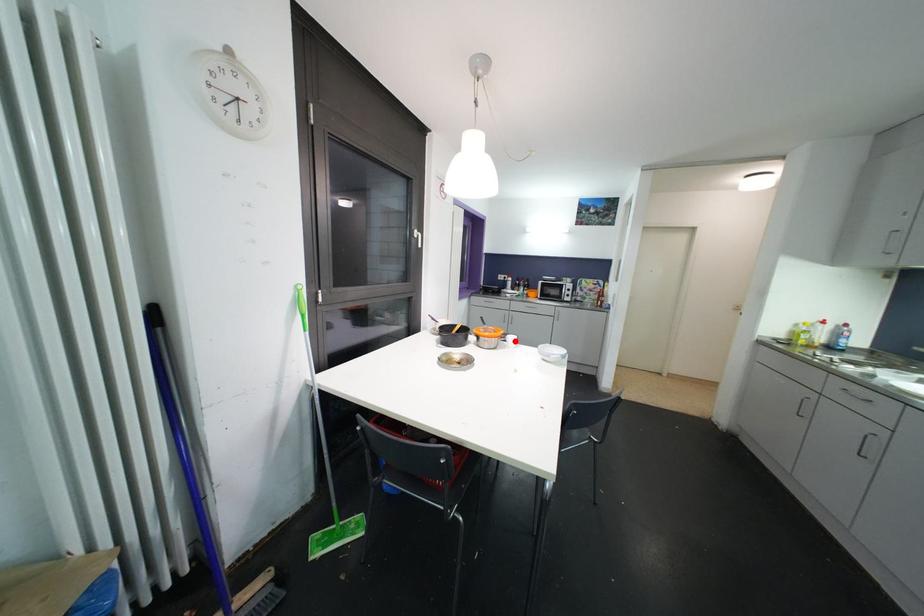
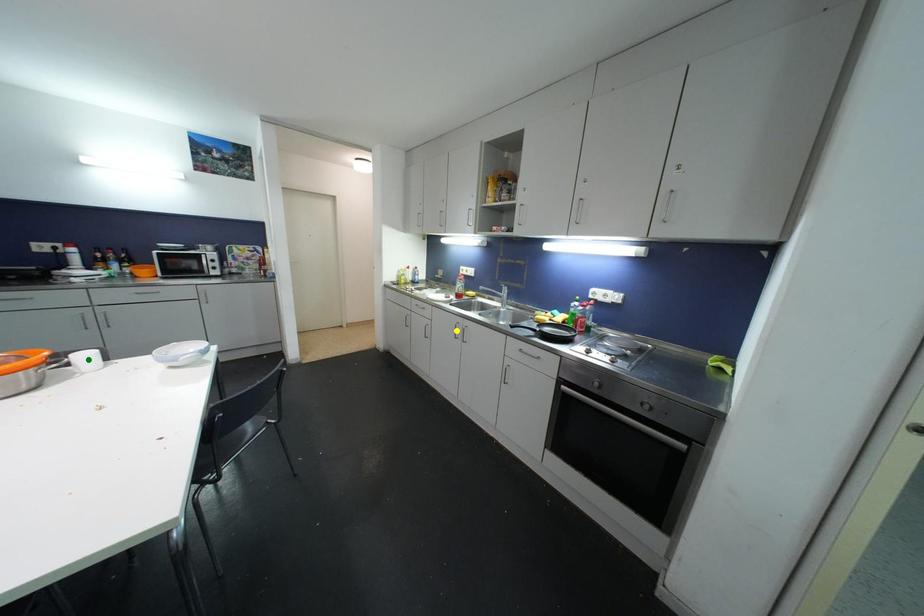
Question: I am providing you with two images of the same scene from different viewpoints. A red point is marked on the first image. You are given multiple points on the second image. Can you choose the point in image 2 that corresponds to the point in image 1?

Choices:
 (A) blue point
 (B) green point
 (C) yellow point

Answer: (B)